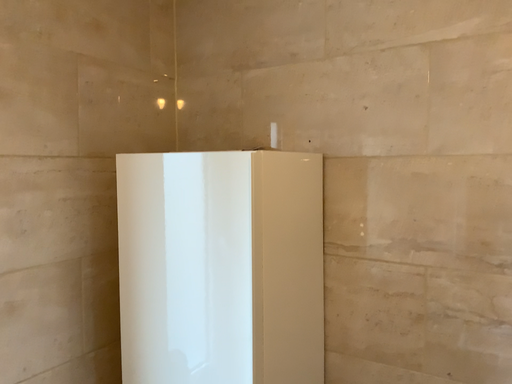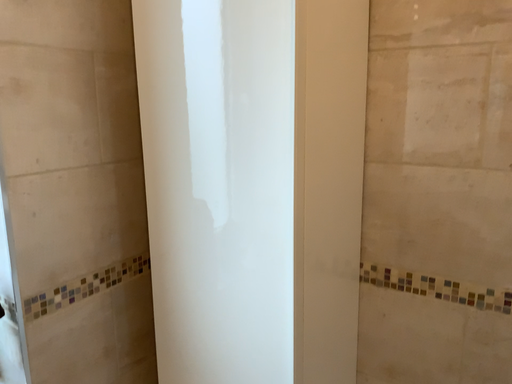
Question: How did the camera likely rotate when shooting the video?

Choices:
 (A) rotated downward
 (B) rotated upward

Answer: (A)